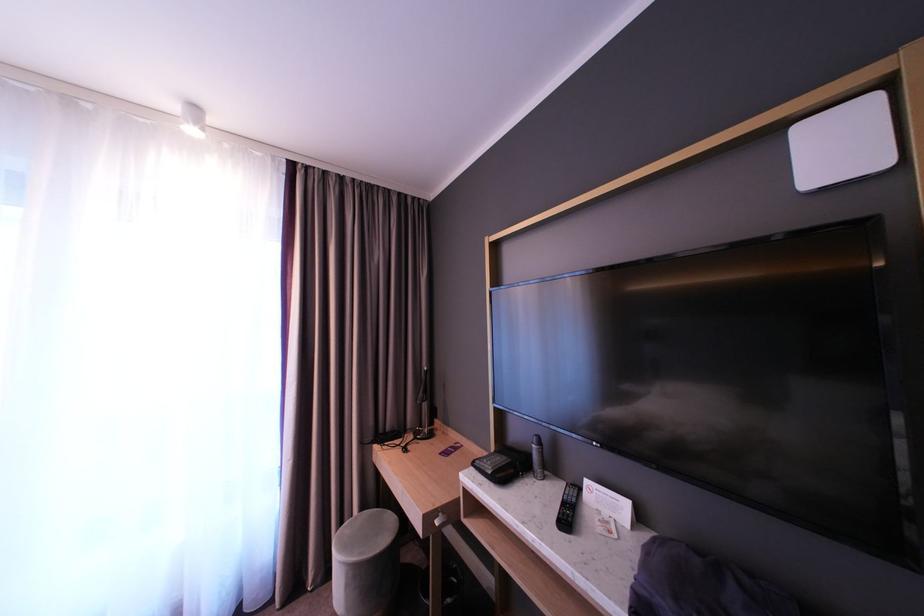
Image resolution: width=924 pixels, height=616 pixels. Identify the location of black spray bottle. (537, 456).